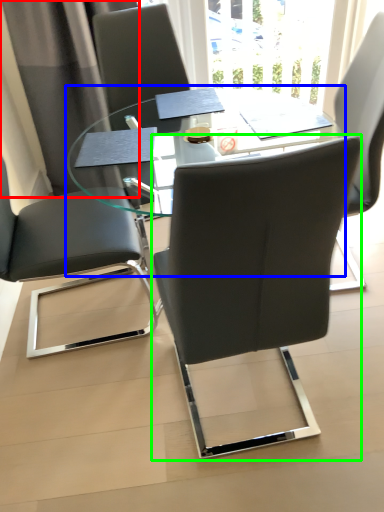
Question: Which is farther away from curtain (highlighted by a red box)? table (highlighted by a blue box) or chair (highlighted by a green box)?

Choices:
 (A) table
 (B) chair

Answer: (B)